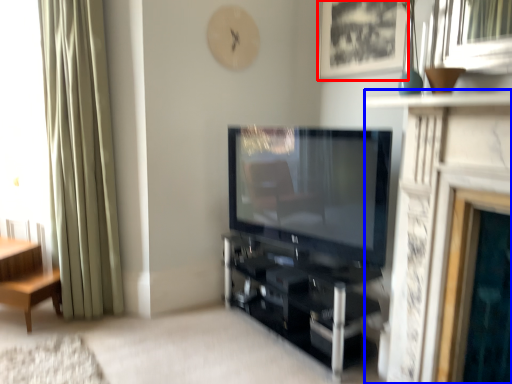
Question: Which of the following is the closest to the observer, picture frame (highlighted by a red box) or fireplace (highlighted by a blue box)?

Choices:
 (A) picture frame
 (B) fireplace

Answer: (B)